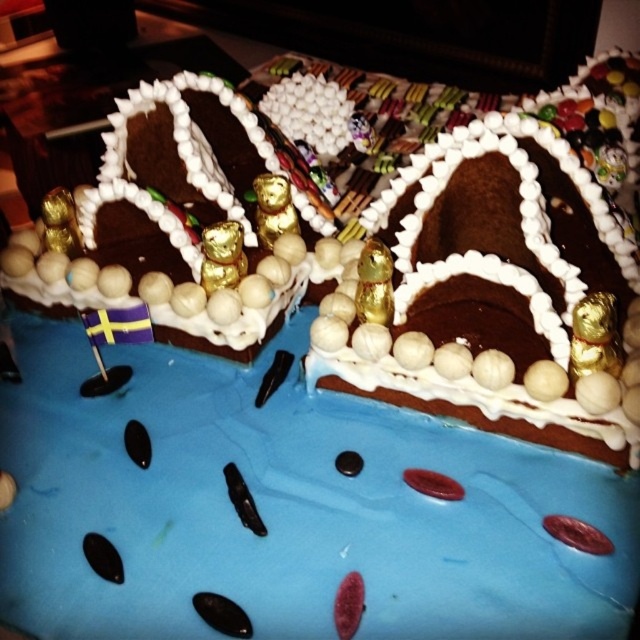
Question: Can you confirm if chocolate matte cake at center is positioned below chocolate matte gingerbread house at left?

Choices:
 (A) no
 (B) yes

Answer: (B)

Question: Which object is closer to the camera taking this photo?

Choices:
 (A) chocolate matte gingerbread house at left
 (B) chocolate matte cake at center

Answer: (B)

Question: Is chocolate matte cake at center positioned at the back of chocolate matte gingerbread house at left?

Choices:
 (A) no
 (B) yes

Answer: (A)

Question: Among these points, which one is nearest to the camera?

Choices:
 (A) (433, 147)
 (B) (182, 177)

Answer: (A)

Question: Is chocolate matte cake at center thinner than chocolate matte gingerbread house at left?

Choices:
 (A) no
 (B) yes

Answer: (B)